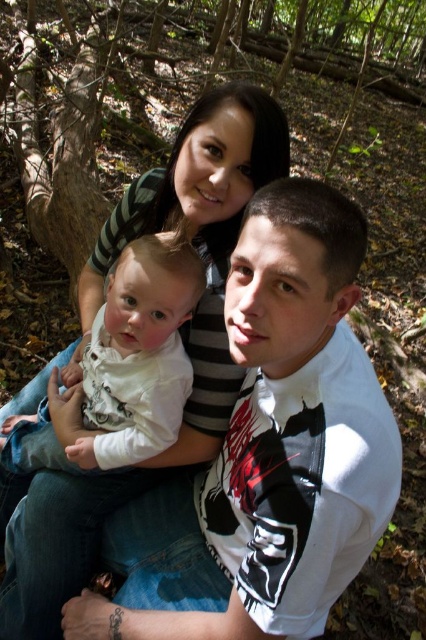
You are a photographer trying to capture a photo of the white matte shirt at center and the white soft fabric baby at center. Which object should you focus on first to ensure both are in focus?

You should focus on the white matte shirt at center first because it is closer to the viewer than the white soft fabric baby at center, so adjusting focus from near to far will help both be in focus.

You are a photographer trying to capture a photo of the white matte shirt at center and the white soft fabric baby at center. To ensure both subjects are in focus, you need to know their relative sizes. Which object is taller?

The white matte shirt at center is much taller than the white soft fabric baby at center.